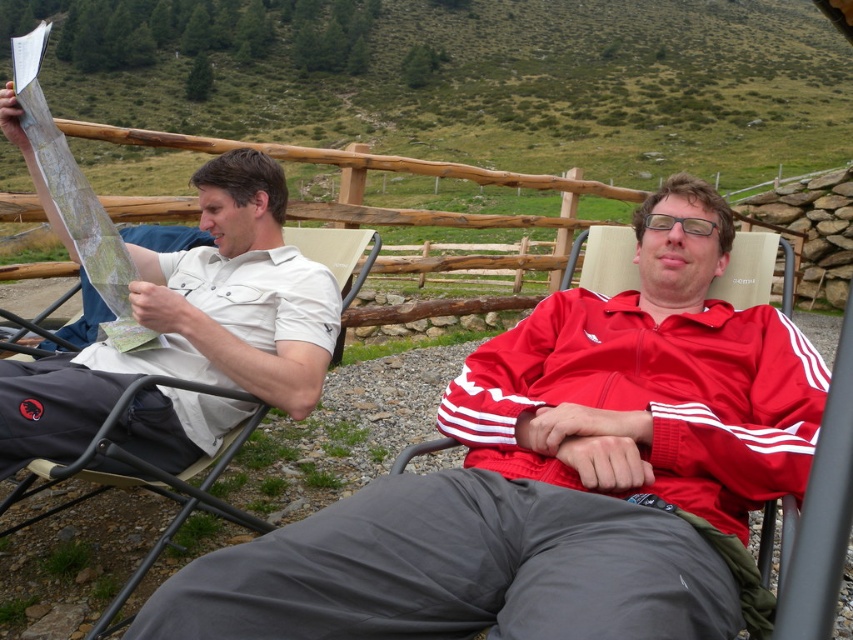
Question: Which point is farther from the camera taking this photo?

Choices:
 (A) (640, 388)
 (B) (239, 195)

Answer: (B)

Question: Can you confirm if matte white shirt at left is positioned to the left of beige fabric beach chair at left?

Choices:
 (A) no
 (B) yes

Answer: (A)

Question: Can you confirm if matte white shirt at left is thinner than beige fabric beach chair at left?

Choices:
 (A) yes
 (B) no

Answer: (A)

Question: Is matte white shirt at left above beige fabric beach chair at left?

Choices:
 (A) no
 (B) yes

Answer: (B)

Question: Which object appears farthest from the camera in this image?

Choices:
 (A) red synthetic jacket at center
 (B) beige fabric beach chair at left
 (C) matte white shirt at left

Answer: (C)

Question: Considering the real-world distances, which object is closest to the beige fabric beach chair at left?

Choices:
 (A) red synthetic jacket at center
 (B) matte white shirt at left

Answer: (B)